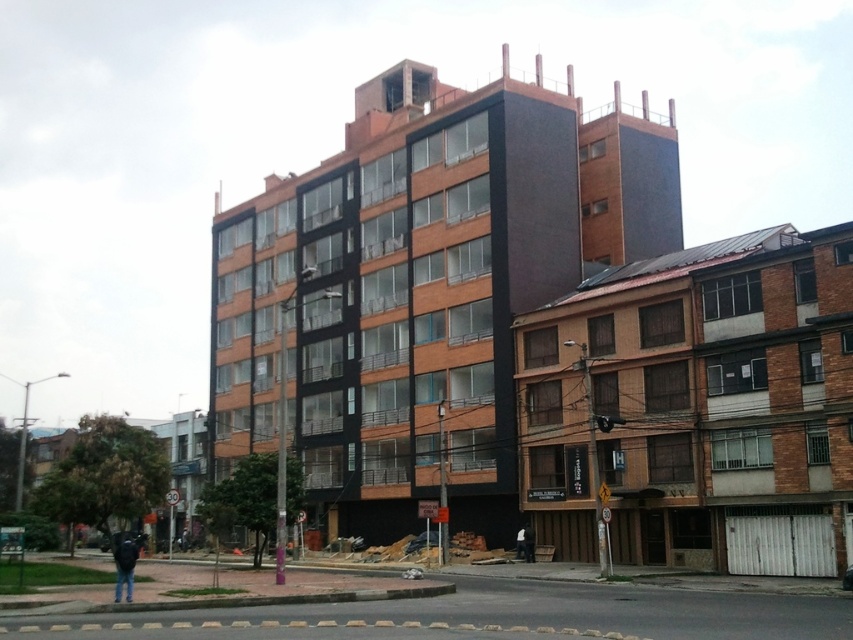
Question: Which point is closer to the camera?

Choices:
 (A) (115, 573)
 (B) (492, 420)

Answer: (A)

Question: Which point is farther from the camera taking this photo?

Choices:
 (A) (436, 433)
 (B) (119, 596)

Answer: (A)

Question: Can you confirm if orange brick building at center is positioned to the right of dark blue jeans at lower left?

Choices:
 (A) no
 (B) yes

Answer: (B)

Question: From the image, what is the correct spatial relationship of orange brick building at center in relation to dark blue jeans at lower left?

Choices:
 (A) above
 (B) below

Answer: (A)

Question: Does orange brick building at center have a larger size compared to dark blue jeans at lower left?

Choices:
 (A) no
 (B) yes

Answer: (B)

Question: Among these points, which one is farthest from the camera?

Choices:
 (A) (128, 600)
 (B) (380, 276)

Answer: (B)